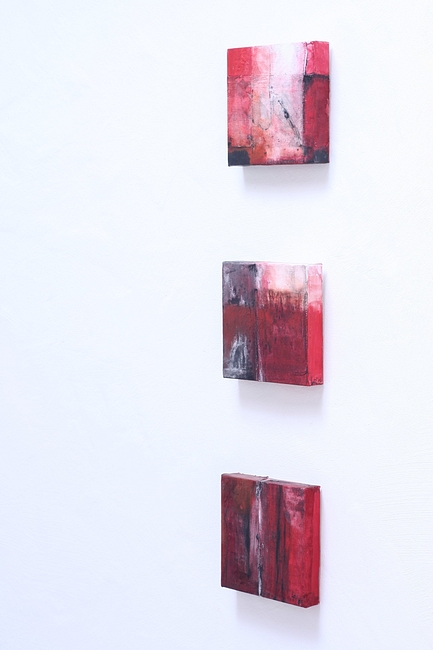
Identify the location of painting. (269, 101).